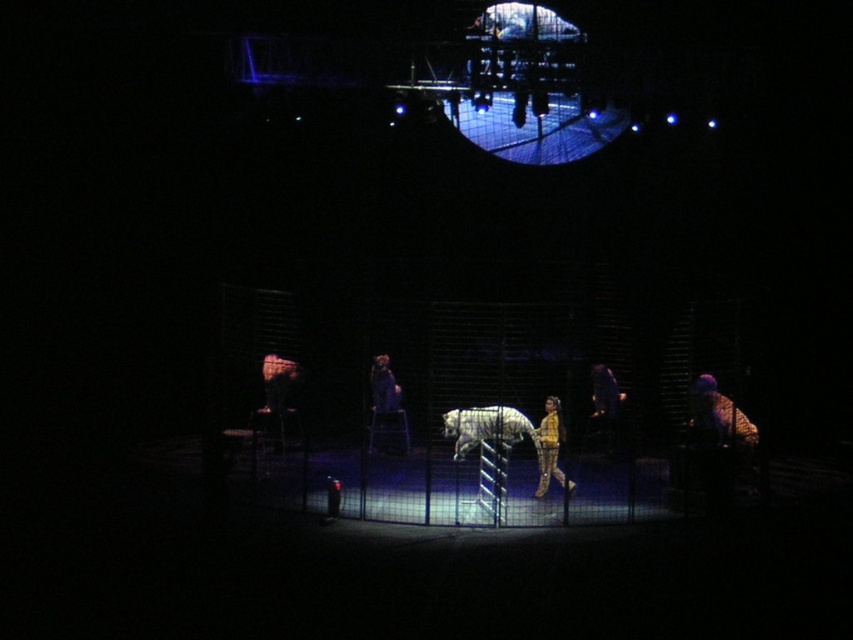
Question: Can you confirm if yellow fabric person at center is wider than dark blue fabric at center?

Choices:
 (A) yes
 (B) no

Answer: (B)

Question: In this image, where is yellow fabric person at center located relative to dark blue fabric at center?

Choices:
 (A) above
 (B) below

Answer: (B)

Question: Which object is farther from the camera taking this photo?

Choices:
 (A) dark blue fabric at center
 (B) white fur tiger at center
 (C) shiny purple bird at right
 (D) yellow fabric person at center

Answer: (A)

Question: Does yellow fabric person at center have a smaller size compared to dark blue fabric at center?

Choices:
 (A) yes
 (B) no

Answer: (A)

Question: Among these points, which one is nearest to the camera?

Choices:
 (A) (486, 419)
 (B) (563, 438)
 (C) (386, 394)

Answer: (A)

Question: Which point is farther to the camera?

Choices:
 (A) (399, 408)
 (B) (695, 392)
 (C) (567, 488)
 (D) (518, 416)

Answer: (A)